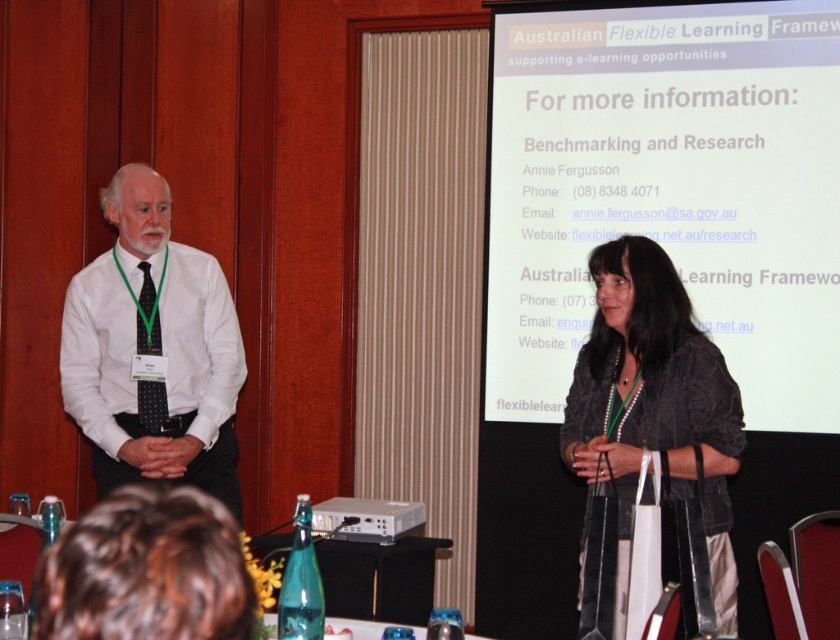
Consider the image. Does white matte projection screen at upper center come behind black dotted tie at left?

Yes.

Locate an element on the screen. This screenshot has height=640, width=840. white matte projection screen at upper center is located at coordinates 668,192.

Who is taller, white matte projection screen at upper center or white plastic projector at lower center?

white matte projection screen at upper center

Does point (580, 292) come closer to viewer compared to point (344, 499)?

Yes, it is.

Locate an element on the screen. Image resolution: width=840 pixels, height=640 pixels. white matte projection screen at upper center is located at coordinates (668, 192).

Where is `white matte projection screen at upper center`? white matte projection screen at upper center is located at coordinates (668, 192).

Is white shirt at center to the right of dark gray textured jacket at center from the viewer's perspective?

Incorrect, white shirt at center is not on the right side of dark gray textured jacket at center.

Who is lower down, white shirt at center or dark gray textured jacket at center?

dark gray textured jacket at center is lower down.

Is point (109, 378) positioned after point (638, 364)?

That is True.

The height and width of the screenshot is (640, 840). In order to click on white shirt at center in this screenshot , I will do `click(151, 349)`.